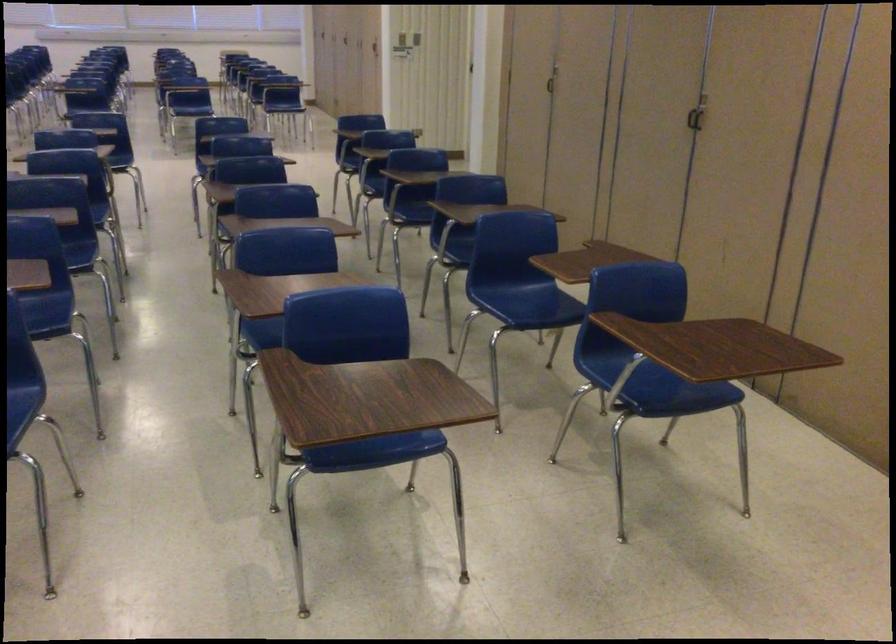
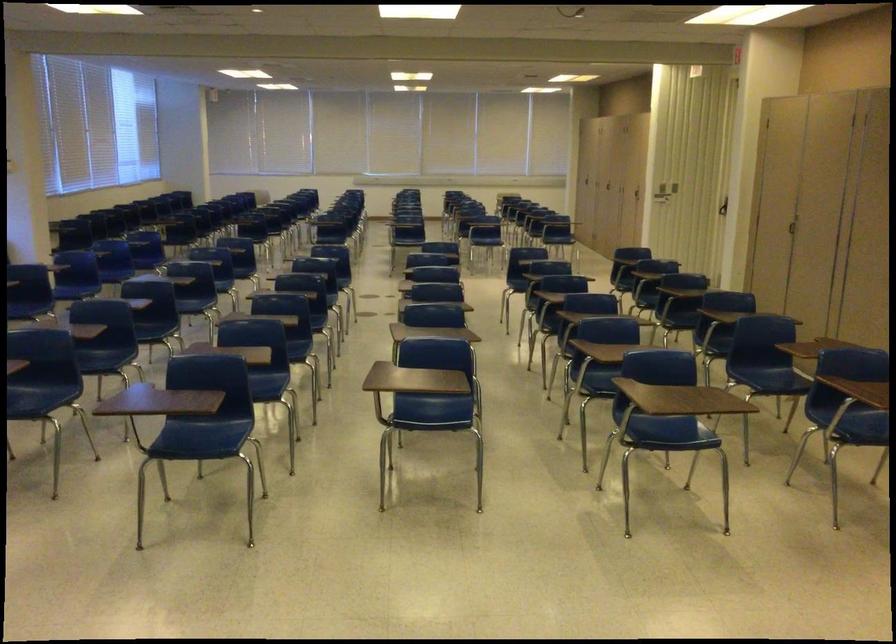
Find the pixel in the second image that matches [552,96] in the first image.

(794, 228)